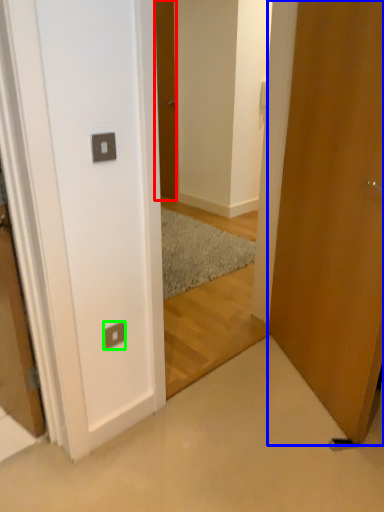
Question: Which object is positioned farthest from door (highlighted by a red box)? Select from door (highlighted by a blue box) and electric outlet (highlighted by a green box).

Choices:
 (A) door
 (B) electric outlet

Answer: (B)